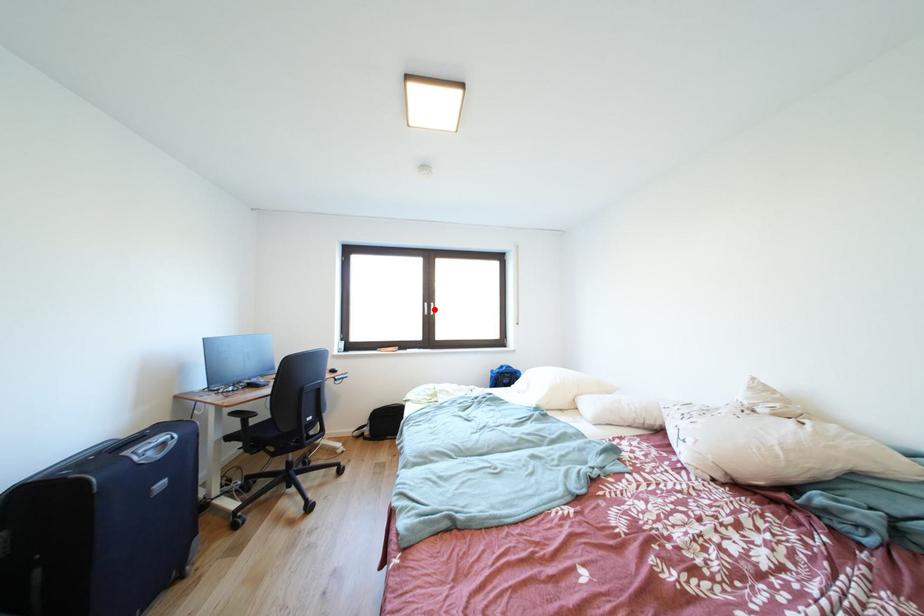
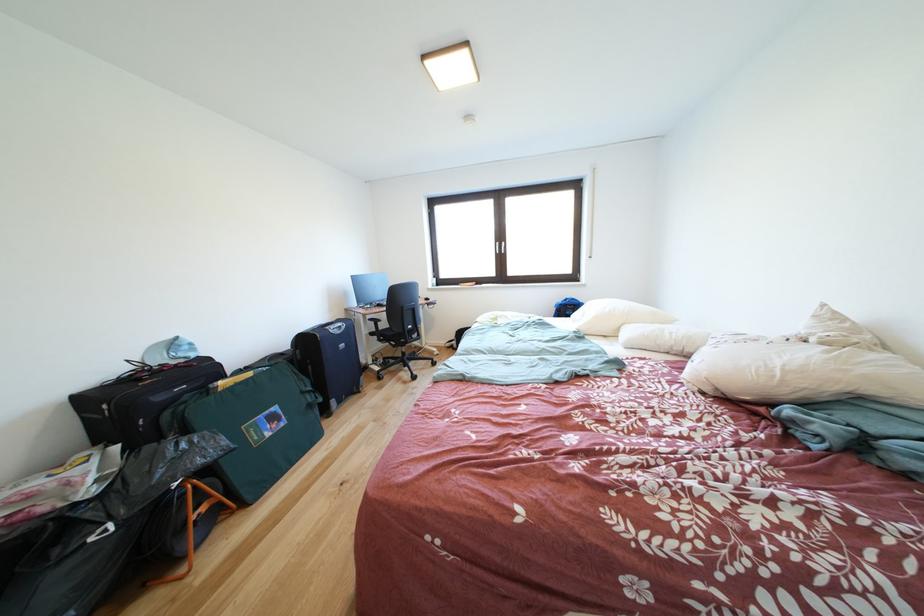
Question: I am providing you with two images of the same scene from different viewpoints. A red point is marked on the first image. Can you still see the location of the red point in image 2?

Choices:
 (A) Yes
 (B) No

Answer: (A)